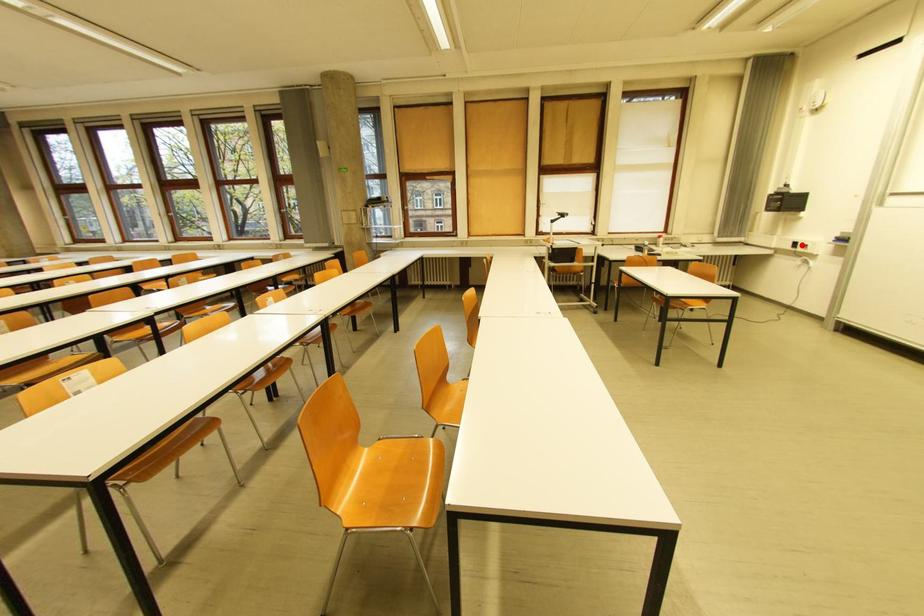
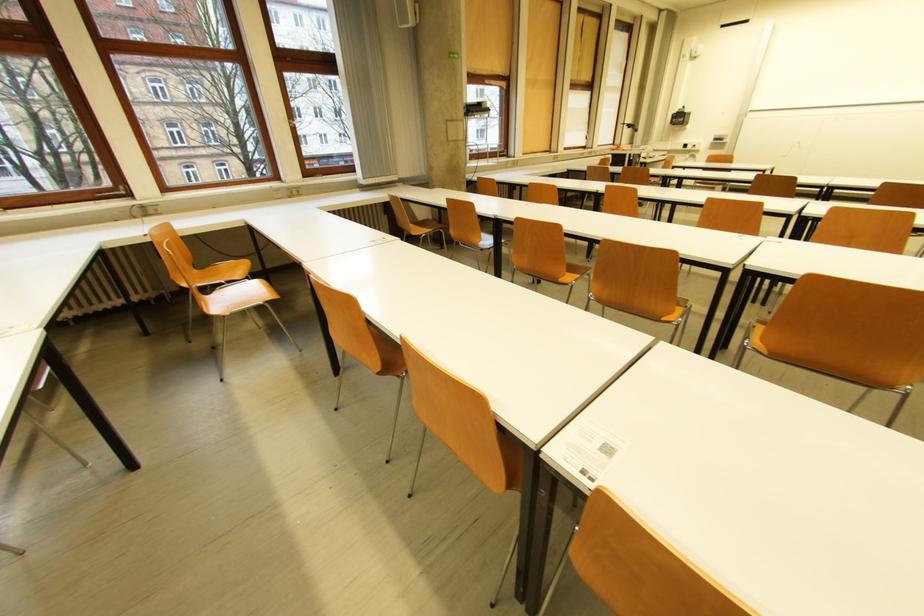
Question: I am providing you with two images of the same scene from different viewpoints. A red point is shown in image1. For the corresponding object point in image2, is it positioned nearer or farther from the camera?

Choices:
 (A) Nearer
 (B) Farther

Answer: (A)